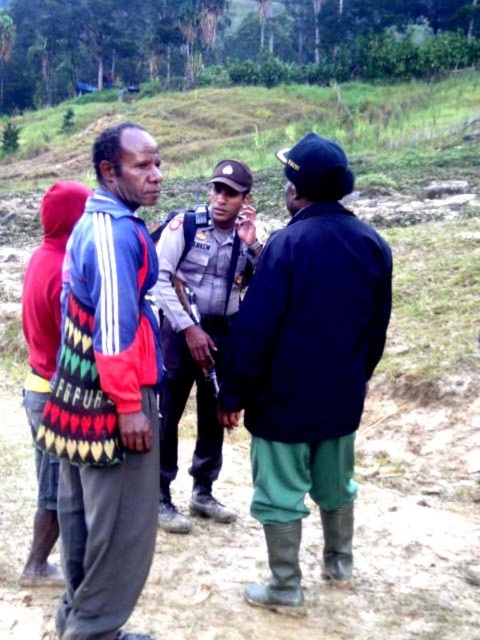
Question: Is dirt field at center to the left of dark blue jacket at center from the viewer's perspective?

Choices:
 (A) no
 (B) yes

Answer: (A)

Question: Which is nearer to the dirt field at center?

Choices:
 (A) light gray uniform at center
 (B) knitted fabric bag at center
 (C) dark blue jacket at center

Answer: (C)

Question: Considering the real-world distances, which object is farthest from the knitted fabric bag at center?

Choices:
 (A) light gray uniform at center
 (B) dirt field at center

Answer: (B)

Question: Which point is farther from the camera taking this photo?

Choices:
 (A) (361, 420)
 (B) (276, 269)
 (C) (73, 266)

Answer: (A)

Question: Can you confirm if knitted fabric bag at center is smaller than light gray uniform at center?

Choices:
 (A) no
 (B) yes

Answer: (B)

Question: Observing the image, what is the correct spatial positioning of dirt field at center in reference to light gray uniform at center?

Choices:
 (A) right
 (B) left

Answer: (A)